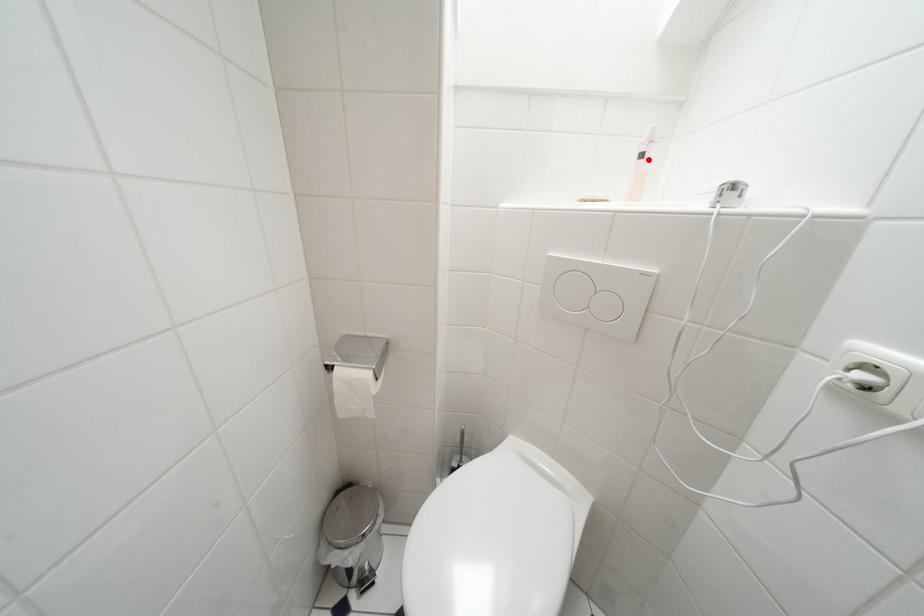
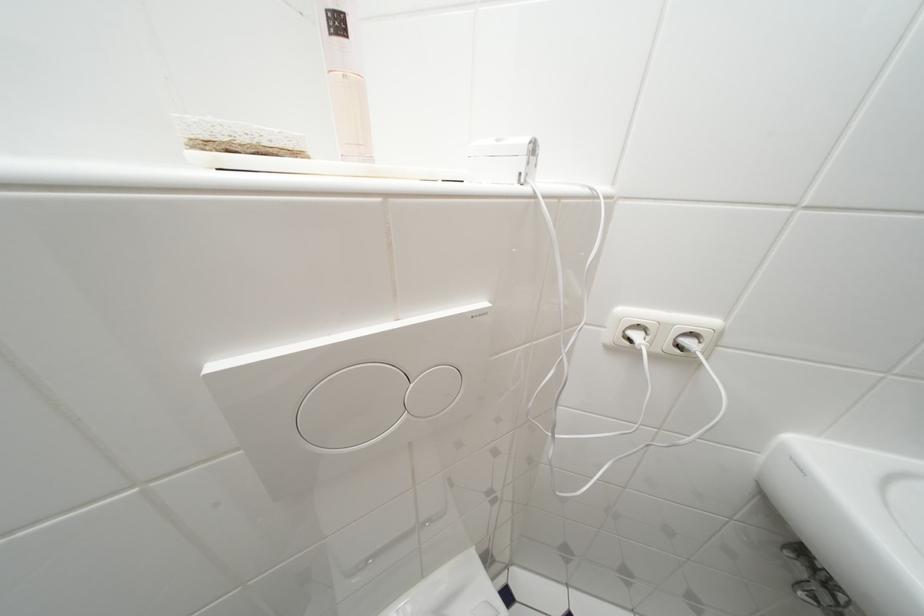
In the second image, find the point that corresponds to the highlighted location in the first image.

(345, 26)